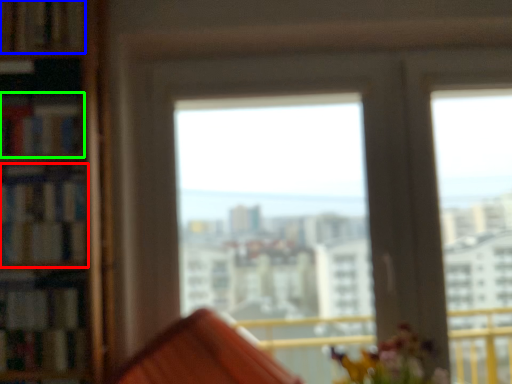
Question: Which object is positioned closest to book (highlighted by a red box)? Select from book (highlighted by a blue box) and book (highlighted by a green box).

Choices:
 (A) book
 (B) book

Answer: (B)